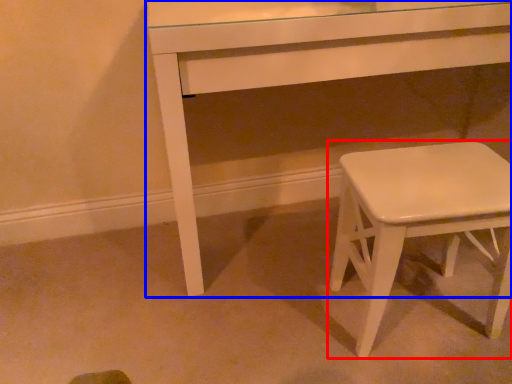
Question: Which object is closer to the camera taking this photo, stool (highlighted by a red box) or table (highlighted by a blue box)?

Choices:
 (A) stool
 (B) table

Answer: (A)